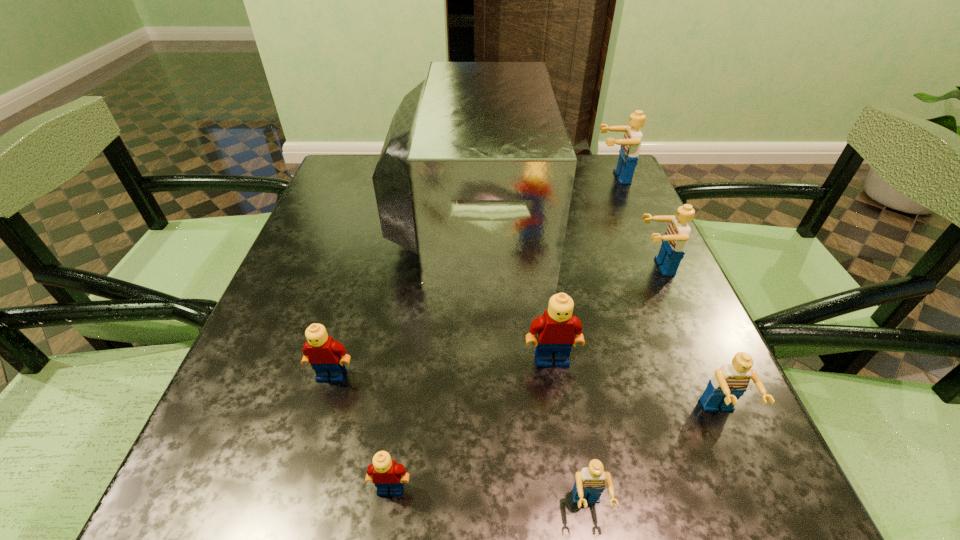
Find the location of a particular element. Image resolution: width=960 pixels, height=540 pixels. vacant space in between the second farthest Lego and the second smallest yellow Lego is located at coordinates (493, 321).

Where is `free space between the biggest blue Lego and the nearest yellow Lego`? free space between the biggest blue Lego and the nearest yellow Lego is located at coordinates (502, 333).

Find the location of a particular element. free space between the nearest yellow Lego and the second smallest blue Lego is located at coordinates (556, 451).

The width and height of the screenshot is (960, 540). Find the location of `unoccupied area between the tallest object and the second yellow Lego from right to left`. unoccupied area between the tallest object and the second yellow Lego from right to left is located at coordinates (431, 350).

Locate an element on the screen. The width and height of the screenshot is (960, 540). object that is the fifth closest to the leftmost yellow Lego is located at coordinates (729, 383).

Identify which object is the nearest to the tallest object. Please provide its 2D coordinates. Your answer should be formatted as a tuple, i.e. [(x, y)], where the tuple contains the x and y coordinates of a point satisfying the conditions above.

[(630, 144)]

Identify which Lego is the third closest to the seventh shortest object. Please provide its 2D coordinates. Your answer should be formatted as a tuple, i.e. [(x, y)], where the tuple contains the x and y coordinates of a point satisfying the conditions above.

[(729, 383)]

Select which Lego is the third closest to the second farthest blue Lego. Please provide its 2D coordinates. Your answer should be formatted as a tuple, i.e. [(x, y)], where the tuple contains the x and y coordinates of a point satisfying the conditions above.

[(630, 144)]

Where is `blue Lego object that ranks as the closest to the leftmost blue Lego`? The height and width of the screenshot is (540, 960). blue Lego object that ranks as the closest to the leftmost blue Lego is located at coordinates (729, 383).

Locate which blue Lego is the closest to the biggest yellow Lego. Please provide its 2D coordinates. Your answer should be formatted as a tuple, i.e. [(x, y)], where the tuple contains the x and y coordinates of a point satisfying the conditions above.

[(729, 383)]